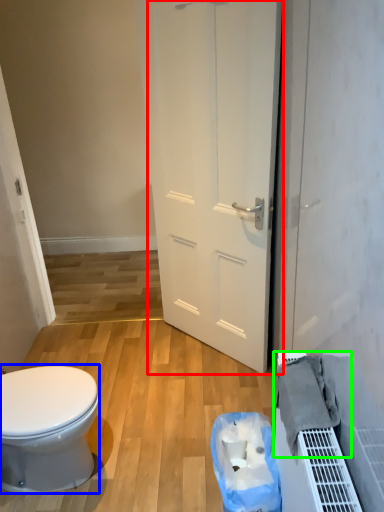
Question: Estimate the real-world distances between objects in this image. Which object is farther from door (highlighted by a red box), bidet (highlighted by a blue box) or material (highlighted by a green box)?

Choices:
 (A) bidet
 (B) material

Answer: (A)